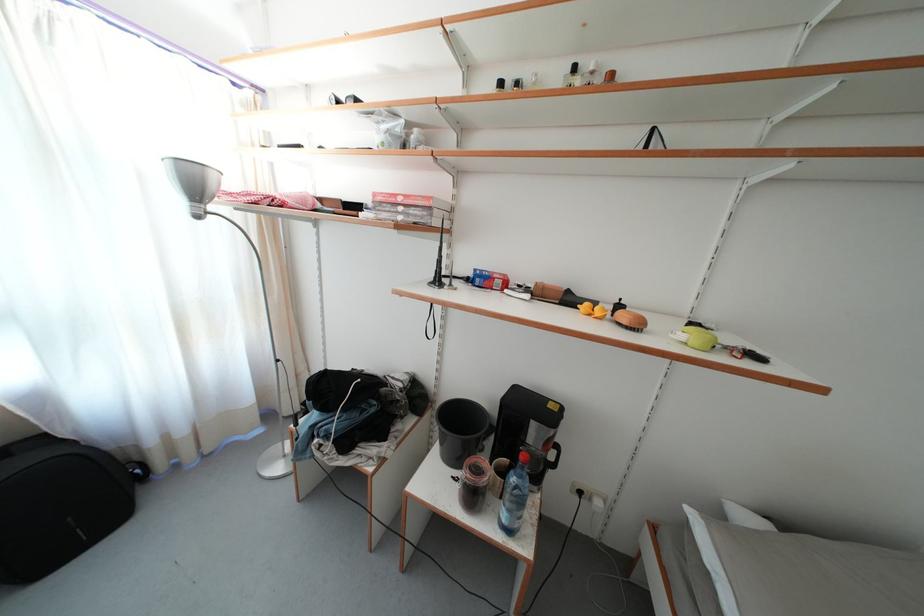
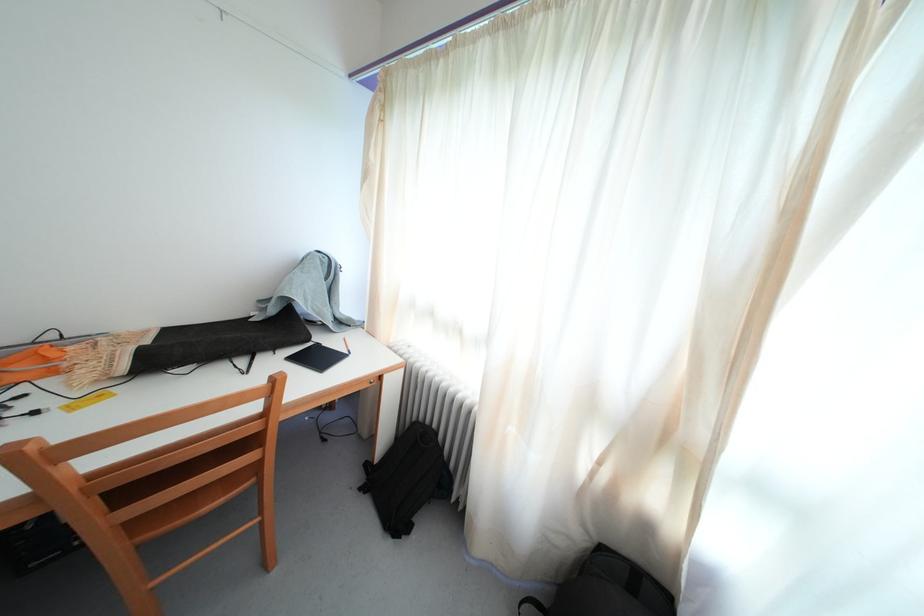
In the scene shown: Based on the continuous images, in which direction is the camera rotating?

The camera rotated toward left-down.